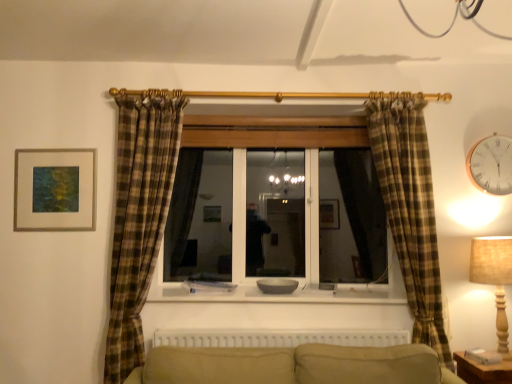
Question: Is matte gold picture frame at upper left turned away from gold metallic clock at upper right?

Choices:
 (A) yes
 (B) no

Answer: (B)

Question: Is gold metallic clock at upper right surrounded by matte gold picture frame at upper left?

Choices:
 (A) no
 (B) yes

Answer: (A)

Question: Is matte gold picture frame at upper left positioned behind gold metallic clock at upper right?

Choices:
 (A) no
 (B) yes

Answer: (B)

Question: Is matte gold picture frame at upper left positioned far away from gold metallic clock at upper right?

Choices:
 (A) no
 (B) yes

Answer: (B)

Question: Considering the relative sizes of matte gold picture frame at upper left and gold metallic clock at upper right in the image provided, is matte gold picture frame at upper left taller than gold metallic clock at upper right?

Choices:
 (A) no
 (B) yes

Answer: (B)

Question: Considering the relative positions of smooth white window sill at center and white plastic radiator at lower center in the image provided, is smooth white window sill at center to the left or to the right of white plastic radiator at lower center?

Choices:
 (A) right
 (B) left

Answer: (B)

Question: Considering the positions of smooth white window sill at center and white plastic radiator at lower center in the image, is smooth white window sill at center bigger or smaller than white plastic radiator at lower center?

Choices:
 (A) small
 (B) big

Answer: (B)

Question: Considering their positions, is smooth white window sill at center located in front of or behind white plastic radiator at lower center?

Choices:
 (A) front
 (B) behind

Answer: (B)

Question: Does point (156, 288) appear closer or farther from the camera than point (333, 342)?

Choices:
 (A) farther
 (B) closer

Answer: (A)

Question: Visually, is matte gold picture frame at upper left positioned to the left or to the right of white plastic radiator at lower center?

Choices:
 (A) right
 (B) left

Answer: (B)

Question: Considering the positions of matte gold picture frame at upper left and white plastic radiator at lower center in the image, is matte gold picture frame at upper left taller or shorter than white plastic radiator at lower center?

Choices:
 (A) tall
 (B) short

Answer: (A)

Question: From a real-world perspective, is matte gold picture frame at upper left physically located above or below white plastic radiator at lower center?

Choices:
 (A) below
 (B) above

Answer: (B)

Question: Considering their positions, is matte gold picture frame at upper left located in front of or behind white plastic radiator at lower center?

Choices:
 (A) front
 (B) behind

Answer: (B)

Question: Relative to beige fabric lampshade at right, is gold metallic clock at upper right in front or behind?

Choices:
 (A) front
 (B) behind

Answer: (B)

Question: In terms of size, does gold metallic clock at upper right appear bigger or smaller than beige fabric lampshade at right?

Choices:
 (A) small
 (B) big

Answer: (A)